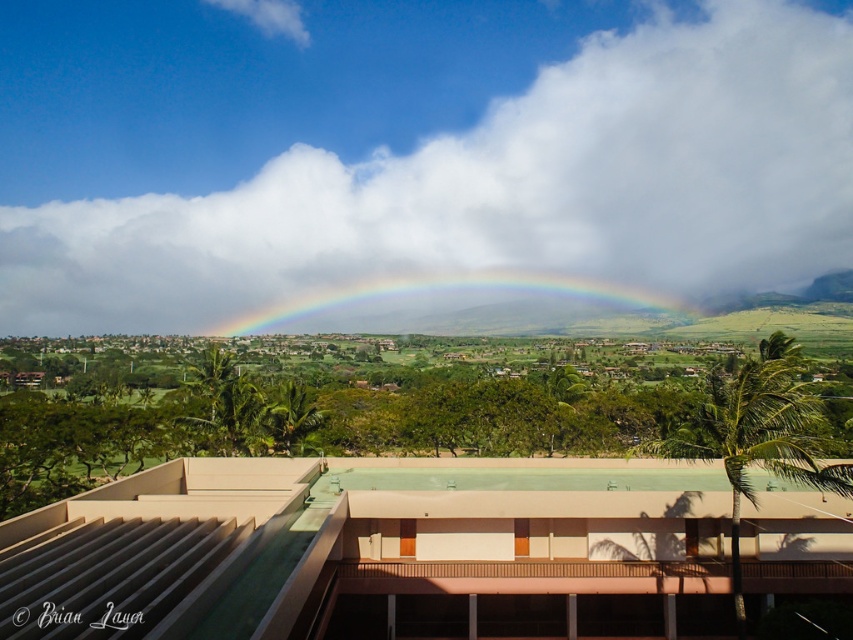
You are an architect designing a new observatory that needs to have a clear view of the sky. The observatory will be built near the modern building with a flat roof. Based on the image, where should you place the observatory so it doesn not block the view of the white fluffy cloud at upper center?

The white fluffy cloud at upper center is located at coordinates point (413, 161). To ensure the observatory does not block the view of this cloud, it should be positioned away from the upper center area of the sky, possibly to the sides or lower sections where there are no obstructions mentioned.